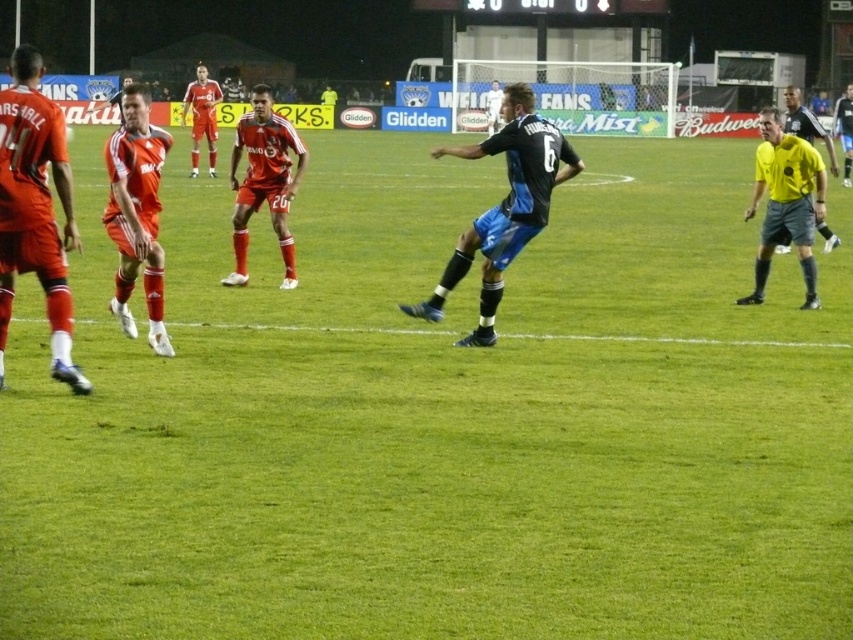
You are a soccer referee observing the match. You need to determine the positions of the black jersey at center and the matte red uniform at upper center. Which player is positioned to the right of the other?

The black jersey at center is positioned on the right side of matte red uniform at upper center, so the black jersey at center is to the right of the matte red uniform at upper center.